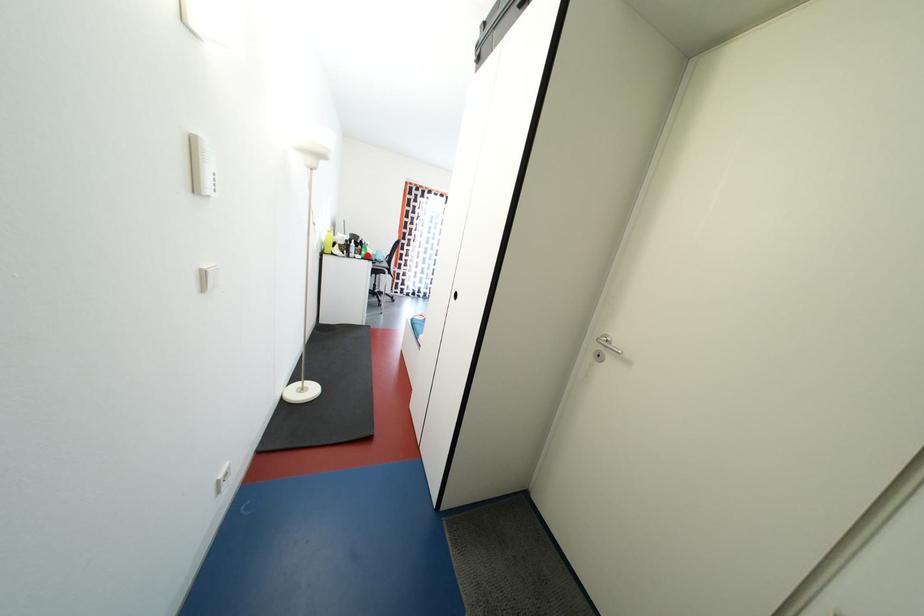
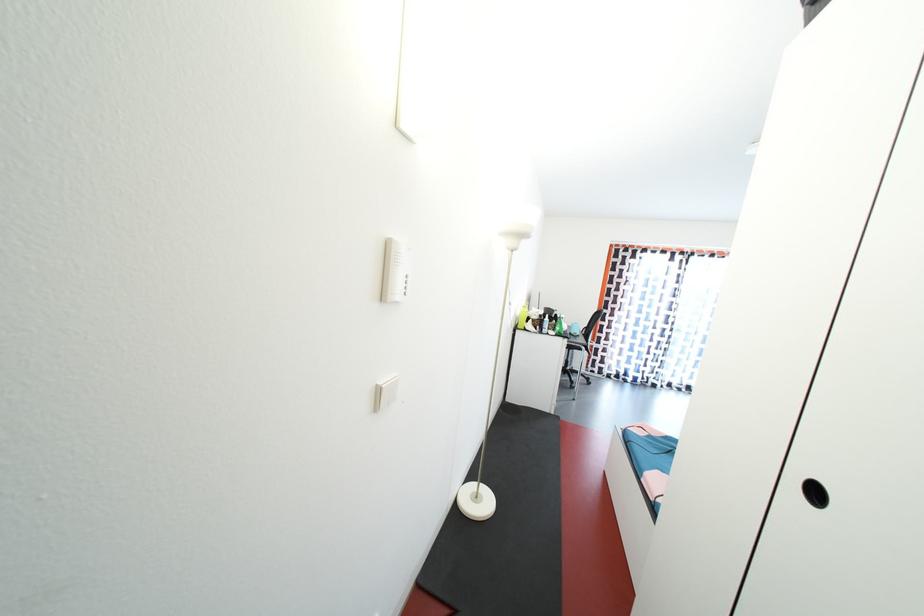
Where in the second image is the point corresponding to the highlighted location from the first image?

(562, 331)